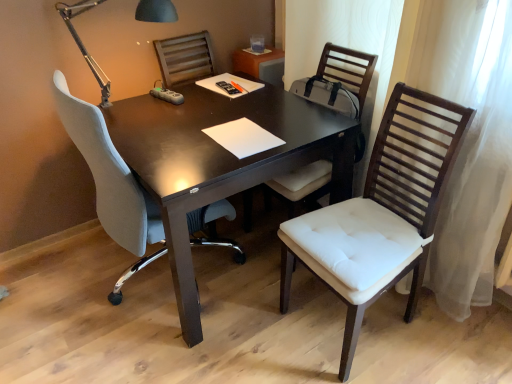
Locate an element on the screen. This screenshot has width=512, height=384. blank space to the left of white paper at center is located at coordinates (177, 137).